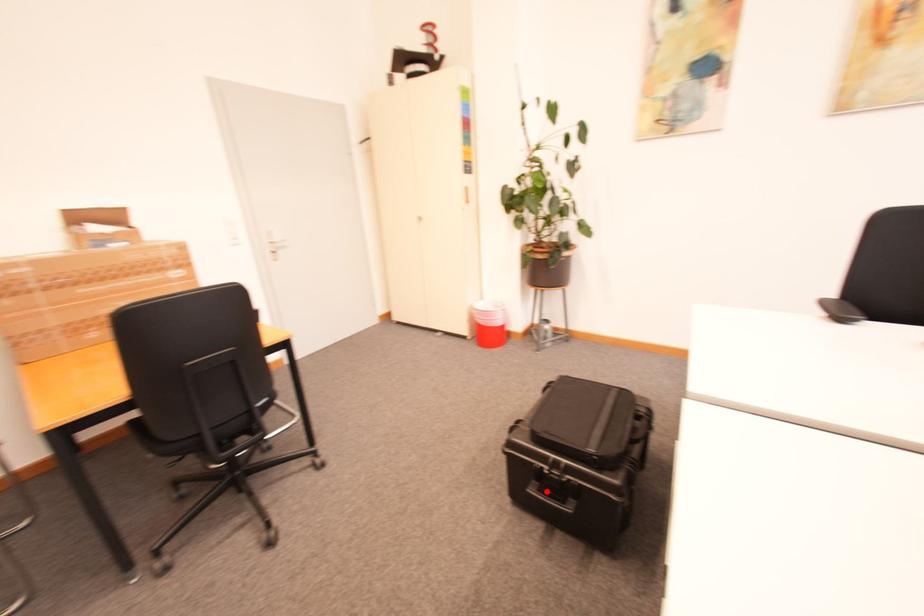
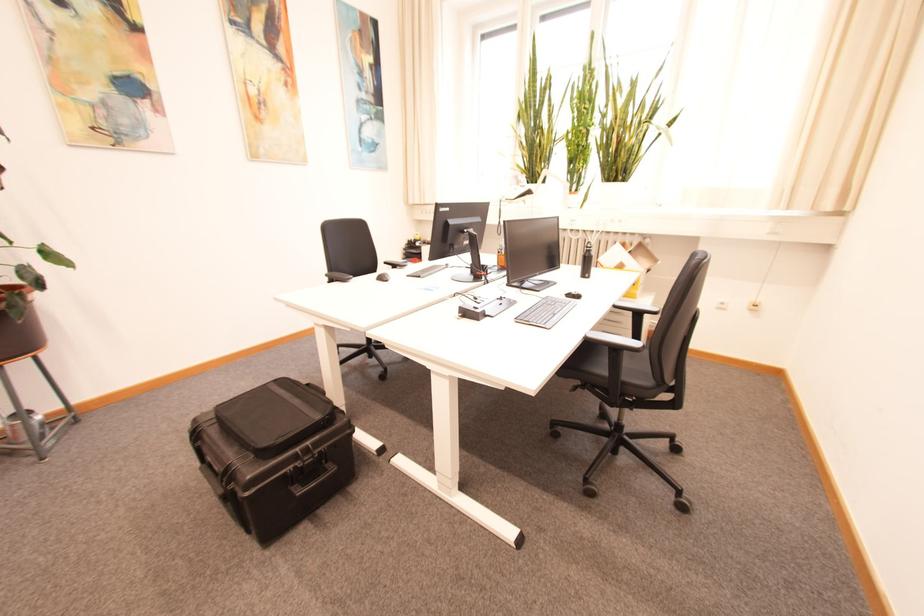
The point at the highlighted location is marked in the first image. Where is the corresponding point in the second image?

(310, 485)